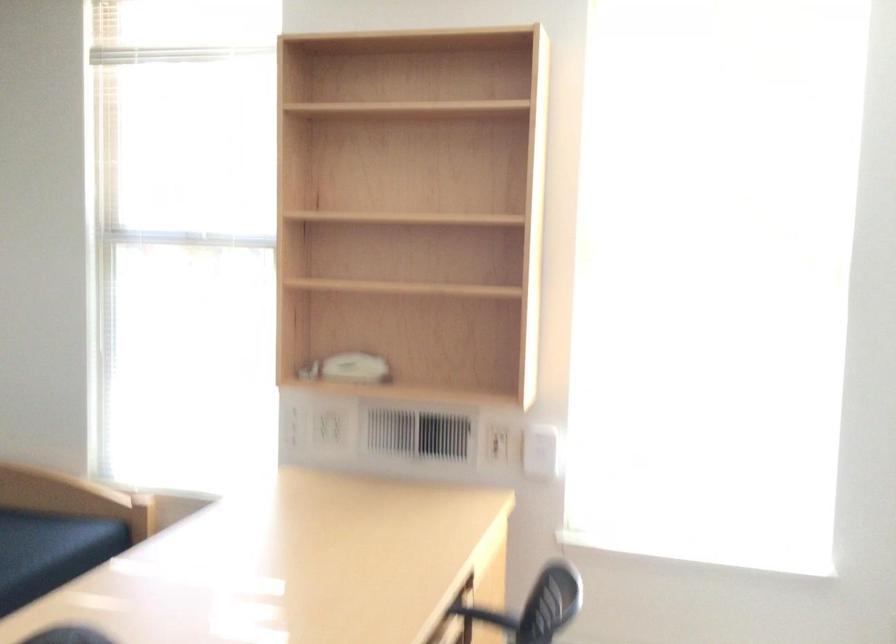
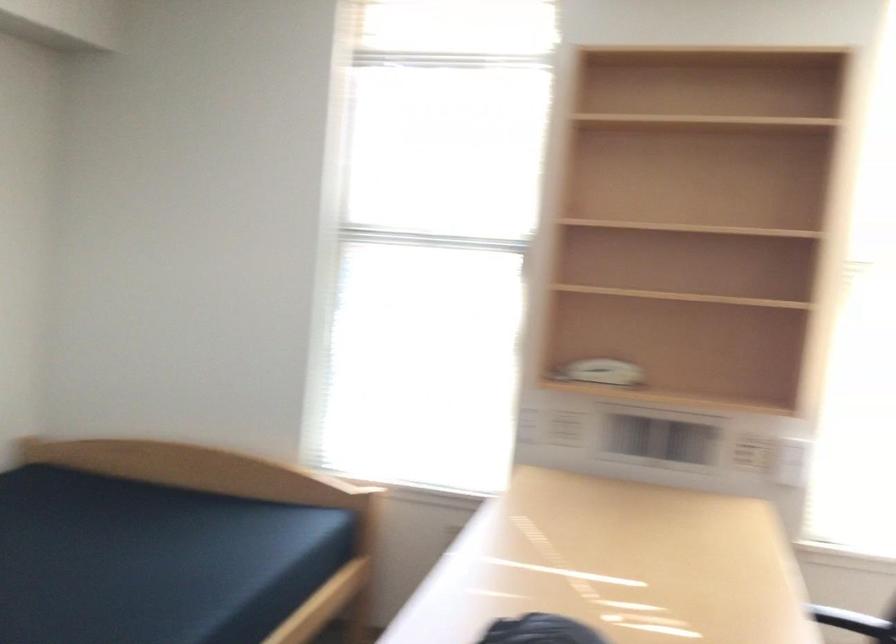
Question: The camera is either moving clockwise (left) or counter-clockwise (right) around the object. The first image is from the beginning of the video and the second image is from the end. Is the camera moving left or right when shooting the video?

Choices:
 (A) Left
 (B) Right

Answer: (B)